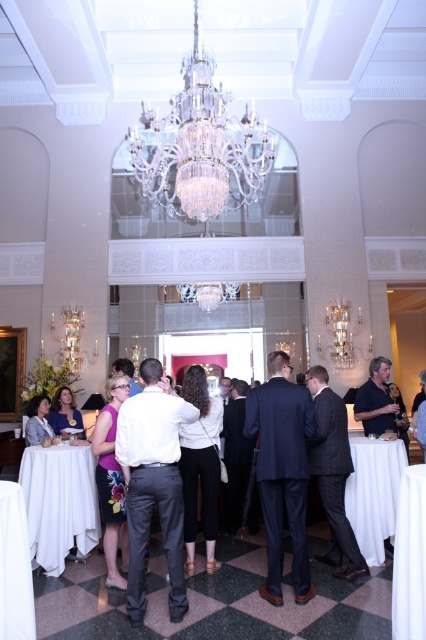
Between clear crystal chandelier at center and dark blue suit at center, which one is positioned lower?

→ dark blue suit at center is below.

Which is in front, point (253, 180) or point (299, 588)?

Positioned in front is point (299, 588).

Does point (149, 177) lie in front of point (270, 596)?

No.

Locate an element on the screen. clear crystal chandelier at center is located at coordinates (199, 147).

Does dark gray pants at center have a larger size compared to white cloth table at lower left?

Yes, dark gray pants at center is bigger than white cloth table at lower left.

Is dark gray pants at center positioned at the back of white cloth table at lower left?

Yes, it is.

Between point (120, 429) and point (17, 563), which one is positioned in front?

Positioned in front is point (17, 563).

Identify the location of dark gray pants at center. (152, 483).

Consider the image. Can you confirm if white cloth-covered table at lower left is positioned above matte purple dress at center?

No.

Is point (58, 518) in front of point (106, 540)?

No.

The height and width of the screenshot is (640, 426). I want to click on white cloth-covered table at lower left, so click(x=60, y=502).